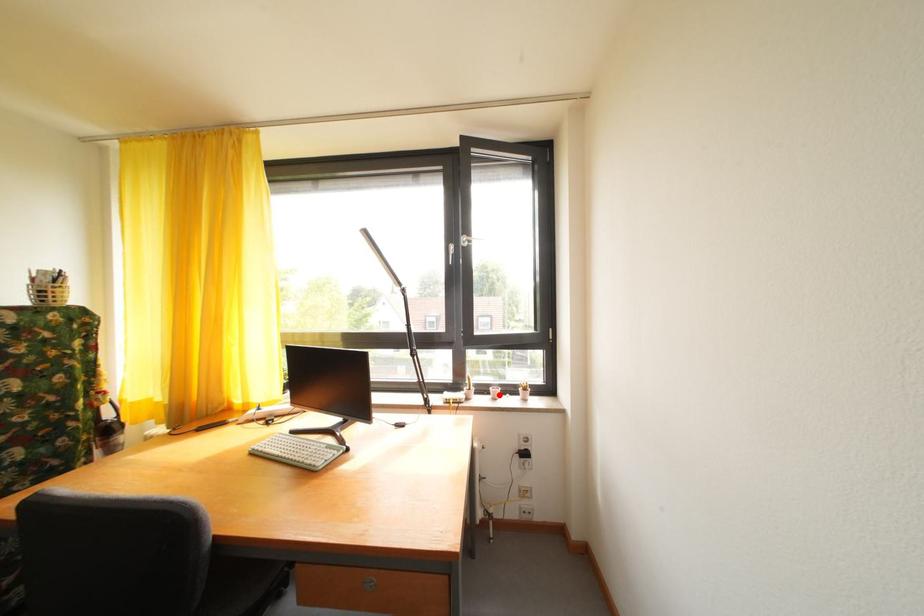
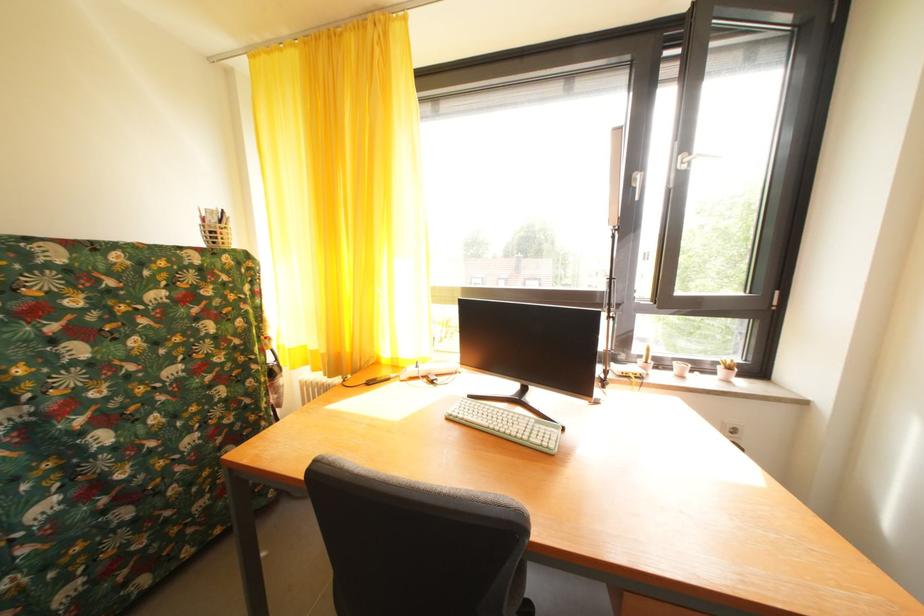
In the second image, find the point that corresponds to the highlighted location in the first image.

(685, 370)